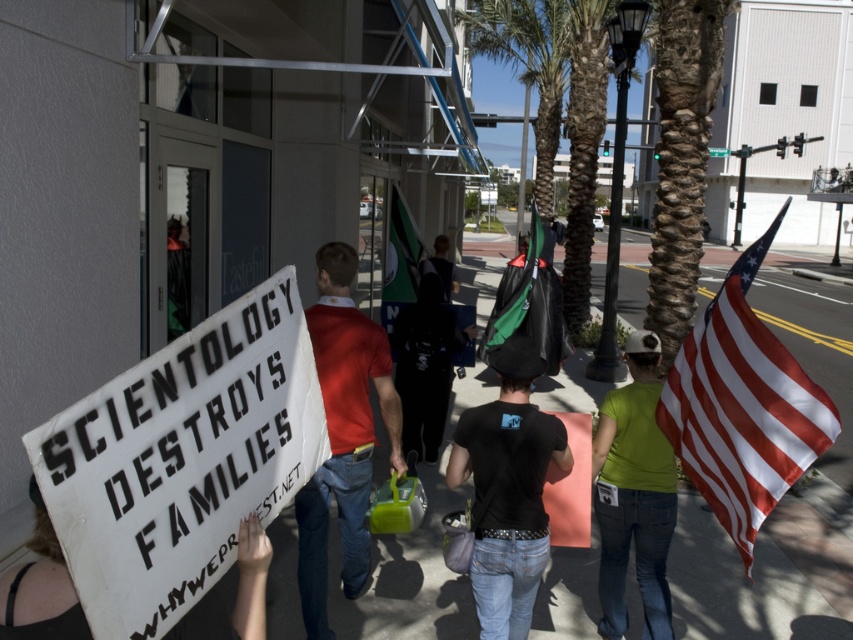
Consider the image. You are a photographer trying to capture both the white cardboard sign at lower left and the green fabric flag at center in a single frame. Based on their heights, which object will appear smaller in your photo?

The white cardboard sign at lower left is shorter than the green fabric flag at center, so it will appear smaller in the photo.

Consider the image. You are a photographer trying to capture the white cardboard sign at lower left for a news article. Based on its position, where should you aim your camera to ensure it is centered in the frame?

The white cardboard sign at lower left is located at point (x=39, y=588), so you should aim your camera towards the lower left quadrant of the image, specifically near the coordinates provided, to center it in the frame.

You are a photographer trying to capture a clear shot of both the green fabric shirt at center and the green fabric flag at center in the protest scene. Since both are green, you want to ensure they are distinguishable in your photo. Which object appears narrower in the image?

The green fabric shirt at center has a lesser width compared to the green fabric flag at center, so the shirt appears narrower in the image.